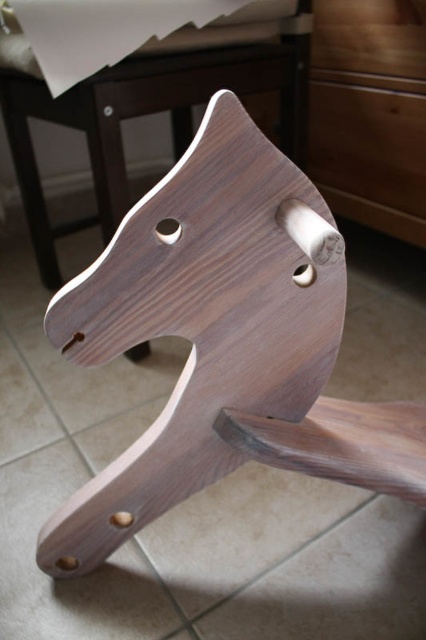
Can you confirm if dark wood/texture rocking horse at center is wider than wooden drawer at upper right?

Yes.

Which is in front, point (178, 321) or point (316, 170)?

Point (178, 321) is in front.

Does point (198, 132) lie behind point (394, 122)?

No, it is not.

Locate an element on the screen. dark wood/texture rocking horse at center is located at coordinates (224, 340).